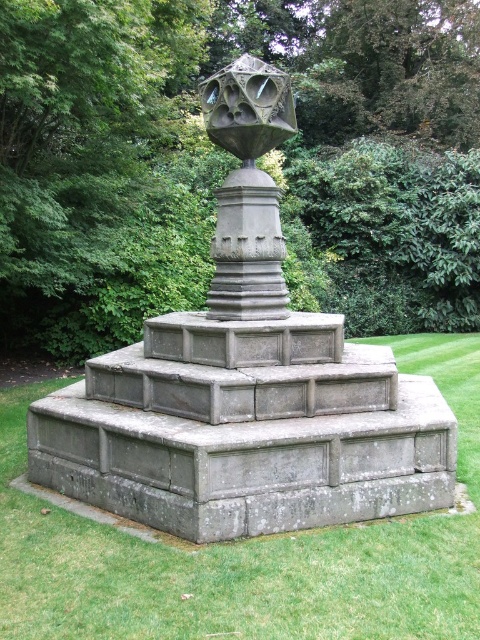
You are standing at the camera position and want to take a photo of the gray stone sculpture at center. If your camera has a maximum focus distance of 4 meters, will you be able to capture the sculpture clearly?

The gray stone sculpture at center and camera are 4.18 meters apart from each other. Since the distance exceeds the camera maximum focus distance of 4 meters, the sculpture will be out of focus and cannot be captured clearly.

Looking at this image, you are a gardener planning to mow the lawn around the polished stone sphere at center. Given that the green grass at center is larger than the sphere, will you need to adjust your mower to avoid hitting the sphere?

The green grass at center is bigger than the polished stone sphere at center, so the sphere is smaller in size. Therefore, you should adjust the mower to avoid hitting the sphere as it is smaller and might be more vulnerable to damage.